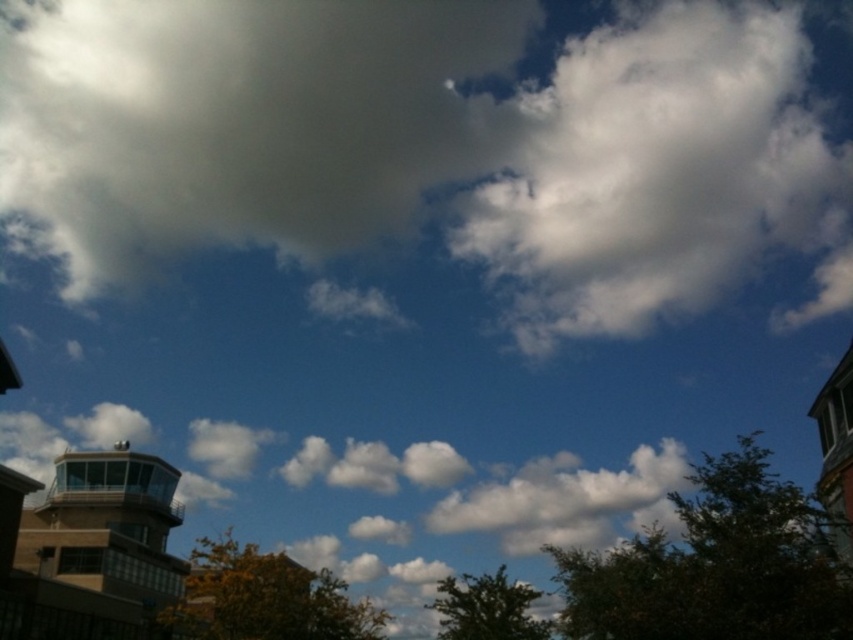
Question: Considering the real-world distances, which object is farthest from the white fluffy cloud at upper center?

Choices:
 (A) white fluffy cloud at upper right
 (B) white fluffy cloud at center
 (C) brown glass tower at lower left

Answer: (C)

Question: Is brown glass tower at lower left smaller than white fluffy cloud at center?

Choices:
 (A) no
 (B) yes

Answer: (B)

Question: Is white fluffy cloud at upper right positioned behind brown glass tower at lower left?

Choices:
 (A) yes
 (B) no

Answer: (A)

Question: Which point is farther to the camera?

Choices:
 (A) (187, 211)
 (B) (741, 61)

Answer: (B)

Question: Which point is farther from the camera taking this photo?

Choices:
 (A) (582, 509)
 (B) (165, 541)

Answer: (A)

Question: Can you confirm if white fluffy cloud at upper center is thinner than white fluffy cloud at upper right?

Choices:
 (A) yes
 (B) no

Answer: (B)